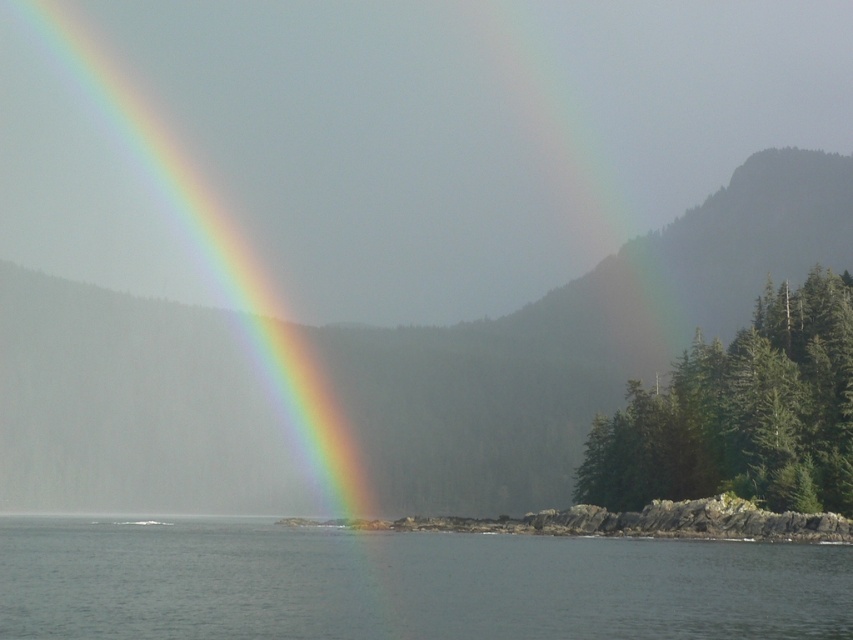
You are an artist trying to paint the scene. You want to paint the rainbow at left and the clear water at lower center. Which object should you paint first if you follow the rule of painting closer objects before distant ones?

You should paint the rainbow at left first because it is closer to the viewer than the clear water at lower center, following the rule of painting closer objects before distant ones.

You are an artist painting the scene and want to ensure the clear water at lower center and the green matte trees at right are proportionally accurate. Which object should you paint as taller?

The green matte trees at right are taller than the clear water at lower center, so you should paint the green matte trees at right as taller.